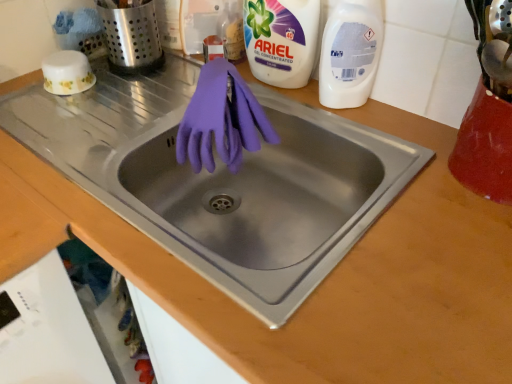
The image size is (512, 384). I want to click on free space on the front side of white plastic bottle at upper right, marked as the first cleaning product in a right-to-left arrangement, so click(x=362, y=139).